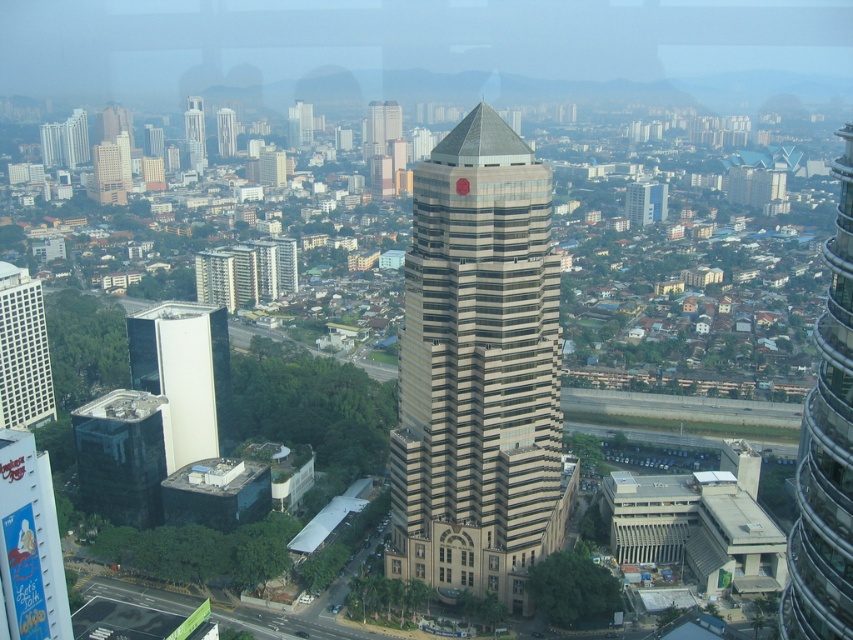
Question: Does beige glass tower at center have a smaller size compared to white glass building at left?

Choices:
 (A) yes
 (B) no

Answer: (B)

Question: Which of these objects is positioned farthest from the matte beige building at left?

Choices:
 (A) beige glass tower at center
 (B) shiny silver skyscraper at right
 (C) beige stone building at center
 (D) beige stone tower at center

Answer: (D)

Question: Is beige glass tower at center above matte beige building at left?

Choices:
 (A) no
 (B) yes

Answer: (B)

Question: Which point is farther from the camera taking this photo?

Choices:
 (A) (202, 392)
 (B) (36, 403)
 (C) (514, 385)

Answer: (B)

Question: Among these objects, which one is nearest to the camera?

Choices:
 (A) beige stone tower at center
 (B) shiny silver skyscraper at right

Answer: (B)

Question: Can you confirm if shiny silver skyscraper at right is positioned above white glass building at left?

Choices:
 (A) no
 (B) yes

Answer: (B)